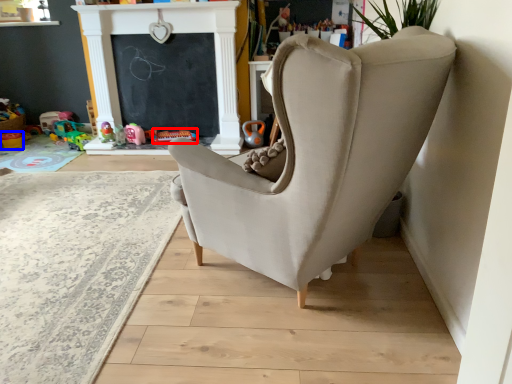
Question: Among these objects, which one is nearest to the camera, toy (highlighted by a red box) or toy (highlighted by a blue box)?

Choices:
 (A) toy
 (B) toy

Answer: (A)